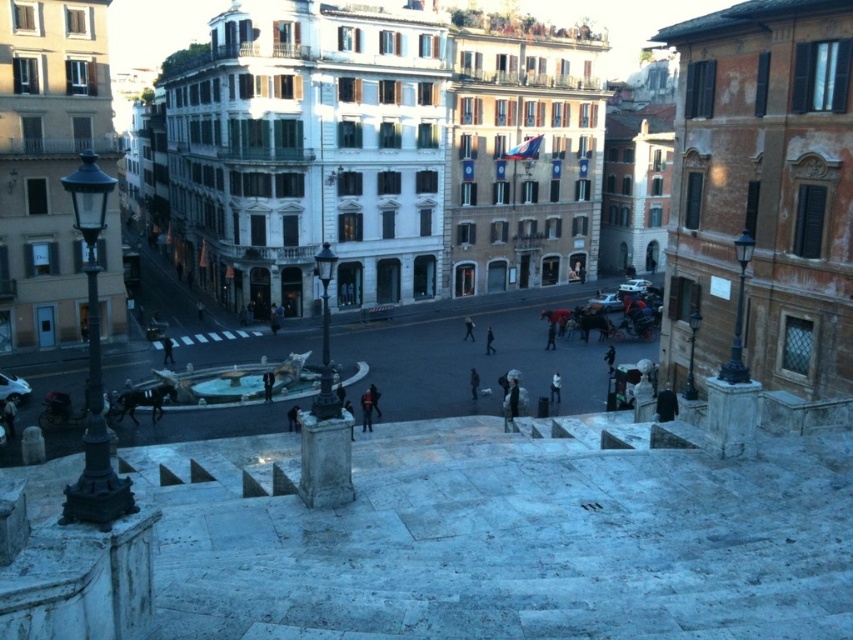
Does white matte person at center come in front of black matte person at center?

Yes, white matte person at center is closer to the viewer.

This screenshot has height=640, width=853. I want to click on white matte person at center, so click(x=555, y=387).

Which is in front, point (556, 381) or point (465, 317)?

Positioned in front is point (556, 381).

Where is `white matte person at center`? This screenshot has width=853, height=640. white matte person at center is located at coordinates (555, 387).

Can you confirm if black matte person at center is thinner than black fabric person at center?

No, black matte person at center is not thinner than black fabric person at center.

Is black matte person at center behind black fabric person at center?

Yes.

The height and width of the screenshot is (640, 853). What are the coordinates of `black matte person at center` in the screenshot? It's located at (468, 328).

Can you confirm if dark blue jeans at center is wider than white matte person at center?

Correct, the width of dark blue jeans at center exceeds that of white matte person at center.

Does dark blue jeans at center have a lesser width compared to white matte person at center?

Incorrect, dark blue jeans at center's width is not less than white matte person at center's.

What do you see at coordinates (366, 410) in the screenshot?
I see `dark blue jeans at center` at bounding box center [366, 410].

Image resolution: width=853 pixels, height=640 pixels. I want to click on dark blue jeans at center, so click(366, 410).